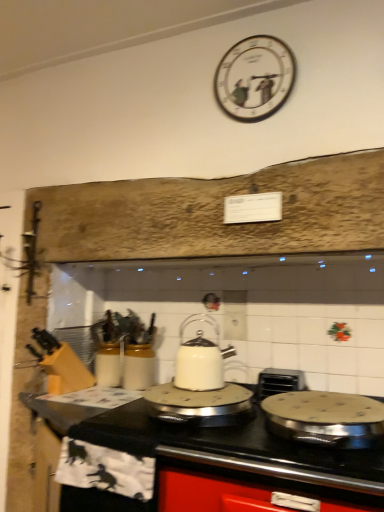
This screenshot has height=512, width=384. Describe the element at coordinates (216, 463) in the screenshot. I see `white glossy countertop at center` at that location.

The width and height of the screenshot is (384, 512). What do you see at coordinates (200, 405) in the screenshot?
I see `white glossy kettle at center, the third kitchen appliance positioned from the right` at bounding box center [200, 405].

You are a GUI agent. You are given a task and a screenshot of the screen. Output one action in this format:
    pyautogui.click(x=<x>, y=<y>)
    Task: Click on the white painted wood clock at upper center
    
    Given the screenshot: What is the action you would take?
    pyautogui.click(x=255, y=78)

Describe the element at coordinates (201, 358) in the screenshot. The image size is (384, 512). I see `white glossy kettle at center, which is counted as the 2th kitchen appliance, starting from the left` at that location.

Locate an element on the screen. The image size is (384, 512). white glossy countertop at center is located at coordinates (216, 463).

Can you confirm if stainless steel frying pan at center, which is counted as the third kitchen appliance, starting from the left, is bigger than silver metallic toaster at center?

Indeed, stainless steel frying pan at center, which is counted as the third kitchen appliance, starting from the left, has a larger size compared to silver metallic toaster at center.

Does stainless steel frying pan at center, marked as the first kitchen appliance in a right-to-left arrangement, turn towards silver metallic toaster at center?

No, stainless steel frying pan at center, marked as the first kitchen appliance in a right-to-left arrangement, does not turn towards silver metallic toaster at center.

From the image's perspective, is stainless steel frying pan at center, which is counted as the third kitchen appliance, starting from the left, under silver metallic toaster at center?

Actually, stainless steel frying pan at center, which is counted as the third kitchen appliance, starting from the left, appears above silver metallic toaster at center in the image.

Locate an element on the screen. The width and height of the screenshot is (384, 512). appliance located below the stainless steel frying pan at center, which is counted as the third kitchen appliance, starting from the left (from the image's perspective) is located at coordinates (279, 382).

From the image's perspective, which object appears higher, white glossy kettle at center, placed as the 1th kitchen appliance when sorted from left to right, or stainless steel frying pan at center, marked as the first kitchen appliance in a right-to-left arrangement?

stainless steel frying pan at center, marked as the first kitchen appliance in a right-to-left arrangement, from the image's perspective.

Does white glossy kettle at center, the third kitchen appliance positioned from the right, turn towards stainless steel frying pan at center, marked as the first kitchen appliance in a right-to-left arrangement?

No, white glossy kettle at center, the third kitchen appliance positioned from the right, is not facing towards stainless steel frying pan at center, marked as the first kitchen appliance in a right-to-left arrangement.

From a real-world perspective, is white glossy kettle at center, the third kitchen appliance positioned from the right, over stainless steel frying pan at center, which is counted as the third kitchen appliance, starting from the left?

No, from a real-world perspective, white glossy kettle at center, the third kitchen appliance positioned from the right, is not above stainless steel frying pan at center, which is counted as the third kitchen appliance, starting from the left.

Would you say white glossy kettle at center, placed as the 1th kitchen appliance when sorted from left to right, is inside or outside stainless steel frying pan at center, which is counted as the third kitchen appliance, starting from the left?

white glossy kettle at center, placed as the 1th kitchen appliance when sorted from left to right, exists outside the volume of stainless steel frying pan at center, which is counted as the third kitchen appliance, starting from the left.

Based on their positions, is silver metallic toaster at center located to the left or right of white glossy countertop at center?

From the image, it's evident that silver metallic toaster at center is to the right of white glossy countertop at center.

Where is `appliance above the white glossy countertop at center (from a real-world perspective)`? The height and width of the screenshot is (512, 384). appliance above the white glossy countertop at center (from a real-world perspective) is located at coordinates (279, 382).

Is white glossy countertop at center at the back of silver metallic toaster at center?

Yes, silver metallic toaster at center's orientation is away from white glossy countertop at center.

Is there a large distance between silver metallic toaster at center and white glossy countertop at center?

Actually, silver metallic toaster at center and white glossy countertop at center are a little close together.

In the scene shown: Between white glossy kettle at center, the third kitchen appliance positioned from the right, and silver metallic toaster at center, which one has smaller width?

Thinner between the two is silver metallic toaster at center.

From the picture: From a real-world perspective, does white glossy kettle at center, placed as the 1th kitchen appliance when sorted from left to right, stand above silver metallic toaster at center?

No, from a real-world perspective, white glossy kettle at center, placed as the 1th kitchen appliance when sorted from left to right, is not on top of silver metallic toaster at center.

Between white glossy kettle at center, placed as the 1th kitchen appliance when sorted from left to right, and silver metallic toaster at center, which one has smaller size?

With smaller size is silver metallic toaster at center.

Is point (167, 397) behind point (300, 372)?

No, it is in front of (300, 372).

Is silver metallic toaster at center completely or partially outside of stainless steel frying pan at center, which is counted as the third kitchen appliance, starting from the left?

Absolutely, silver metallic toaster at center is external to stainless steel frying pan at center, which is counted as the third kitchen appliance, starting from the left.

Considering the positions of objects silver metallic toaster at center and stainless steel frying pan at center, which is counted as the third kitchen appliance, starting from the left, in the image provided, who is more to the right, silver metallic toaster at center or stainless steel frying pan at center, which is counted as the third kitchen appliance, starting from the left,?

Positioned to the right is stainless steel frying pan at center, which is counted as the third kitchen appliance, starting from the left.

Considering the positions of point (305, 389) and point (306, 408), is point (305, 389) closer or farther from the camera than point (306, 408)?

Clearly, point (305, 389) is more distant from the camera than point (306, 408).

Is point (205, 378) farther from camera compared to point (163, 396)?

Yes, point (205, 378) is farther from viewer.

Visually, is white glossy kettle at center, which is the second kitchen appliance from right to left, positioned to the left or to the right of white glossy kettle at center, placed as the 1th kitchen appliance when sorted from left to right?

In the image, white glossy kettle at center, which is the second kitchen appliance from right to left, appears on the right side of white glossy kettle at center, placed as the 1th kitchen appliance when sorted from left to right.

From the image's perspective, who appears lower, white glossy kettle at center, which is counted as the 2th kitchen appliance, starting from the left, or white glossy kettle at center, placed as the 1th kitchen appliance when sorted from left to right?

From the image's view, white glossy kettle at center, placed as the 1th kitchen appliance when sorted from left to right, is below.

Considering their positions, is white glossy kettle at center, which is the second kitchen appliance from right to left, located in front of or behind white glossy kettle at center, the third kitchen appliance positioned from the right?

In the image, white glossy kettle at center, which is the second kitchen appliance from right to left, appears behind white glossy kettle at center, the third kitchen appliance positioned from the right.

Is point (347, 447) positioned behind point (233, 71)?

No.

Considering the relative positions of stainless steel frying pan at center, which is counted as the third kitchen appliance, starting from the left, and white painted wood clock at upper center in the image provided, is stainless steel frying pan at center, which is counted as the third kitchen appliance, starting from the left, to the right of white painted wood clock at upper center from the viewer's perspective?

Yes.

The height and width of the screenshot is (512, 384). Identify the location of wall clock that is behind the stainless steel frying pan at center, which is counted as the third kitchen appliance, starting from the left. (255, 78).

Is stainless steel frying pan at center, marked as the first kitchen appliance in a right-to-left arrangement, taller than white painted wood clock at upper center?

Incorrect, the height of stainless steel frying pan at center, marked as the first kitchen appliance in a right-to-left arrangement, is not larger of that of white painted wood clock at upper center.

Find the location of `appliance that is below the stainless steel frying pan at center, marked as the first kitchen appliance in a right-to-left arrangement (from the image's perspective)`. appliance that is below the stainless steel frying pan at center, marked as the first kitchen appliance in a right-to-left arrangement (from the image's perspective) is located at coordinates (279, 382).

This screenshot has height=512, width=384. What are the coordinates of `kitchen appliance that is the 1st one when counting backward from the stainless steel frying pan at center, which is counted as the third kitchen appliance, starting from the left` in the screenshot? It's located at (200, 405).

From the image, which object appears to be nearer to white glossy countertop at center, silver metallic toaster at center or white glossy kettle at center, the third kitchen appliance positioned from the right?

white glossy kettle at center, the third kitchen appliance positioned from the right, lies closer to white glossy countertop at center than the other object.

Considering their positions, is silver metallic toaster at center positioned further to white glossy kettle at center, the third kitchen appliance positioned from the right, than stainless steel frying pan at center, marked as the first kitchen appliance in a right-to-left arrangement?

The object further to white glossy kettle at center, the third kitchen appliance positioned from the right, is stainless steel frying pan at center, marked as the first kitchen appliance in a right-to-left arrangement.

Which object lies further to the anchor point white glossy kettle at center, the third kitchen appliance positioned from the right, white painted wood clock at upper center or white glossy kettle at center, which is counted as the 2th kitchen appliance, starting from the left?

white painted wood clock at upper center is further to white glossy kettle at center, the third kitchen appliance positioned from the right.

From the image, which object appears to be farther from silver metallic toaster at center, stainless steel frying pan at center, marked as the first kitchen appliance in a right-to-left arrangement, or white painted wood clock at upper center?

The object further to silver metallic toaster at center is white painted wood clock at upper center.

From the image, which object appears to be farther from white glossy kettle at center, which is the second kitchen appliance from right to left, white painted wood clock at upper center or white glossy kettle at center, placed as the 1th kitchen appliance when sorted from left to right?

white painted wood clock at upper center is positioned further to the anchor white glossy kettle at center, which is the second kitchen appliance from right to left.

From the image, which object appears to be farther from white painted wood clock at upper center, white glossy countertop at center or silver metallic toaster at center?

white glossy countertop at center lies further to white painted wood clock at upper center than the other object.

Looking at the image, which one is located further to silver metallic toaster at center, white glossy countertop at center or white painted wood clock at upper center?

white painted wood clock at upper center.

Based on their spatial positions, is white glossy countertop at center or white glossy kettle at center, which is the second kitchen appliance from right to left, closer to stainless steel frying pan at center, which is counted as the third kitchen appliance, starting from the left?

Among the two, white glossy countertop at center is located nearer to stainless steel frying pan at center, which is counted as the third kitchen appliance, starting from the left.

Image resolution: width=384 pixels, height=512 pixels. Identify the location of appliance that lies between white painted wood clock at upper center and white glossy countertop at center from top to bottom. (279, 382).

Where is `kitchen appliance located between white glossy kettle at center, the third kitchen appliance positioned from the right, and silver metallic toaster at center in the left-right direction`? kitchen appliance located between white glossy kettle at center, the third kitchen appliance positioned from the right, and silver metallic toaster at center in the left-right direction is located at coordinates (201, 358).

The image size is (384, 512). Identify the location of kitchen appliance between white painted wood clock at upper center and stainless steel frying pan at center, marked as the first kitchen appliance in a right-to-left arrangement, in the up-down direction. (201, 358).

I want to click on countertop located between white glossy kettle at center, the third kitchen appliance positioned from the right, and stainless steel frying pan at center, which is counted as the third kitchen appliance, starting from the left, in the left-right direction, so click(x=216, y=463).